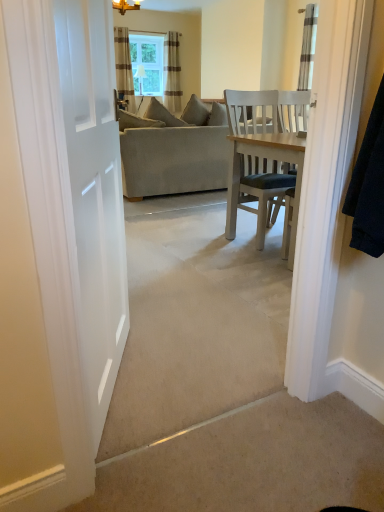
Question: Should I look upward or downward to see striped fabric curtain at upper right, arranged as the third curtain when viewed from the back?

Choices:
 (A) up
 (B) down

Answer: (A)

Question: From the image's perspective, is clear glass window at upper center on striped fabric curtain at upper right, positioned as the third curtain in left-to-right order?

Choices:
 (A) no
 (B) yes

Answer: (B)

Question: Is clear glass window at upper center bigger than striped fabric curtain at upper right, which is counted as the first curtain, starting from the front?

Choices:
 (A) no
 (B) yes

Answer: (B)

Question: Is clear glass window at upper center taller than striped fabric curtain at upper right, which is counted as the first curtain, starting from the front?

Choices:
 (A) no
 (B) yes

Answer: (A)

Question: Can you confirm if clear glass window at upper center is positioned to the left of striped fabric curtain at upper right, which is counted as the first curtain, starting from the front?

Choices:
 (A) no
 (B) yes

Answer: (B)

Question: Is clear glass window at upper center not close to striped fabric curtain at upper right, arranged as the third curtain when viewed from the back?

Choices:
 (A) yes
 (B) no

Answer: (A)

Question: Is clear glass window at upper center thinner than striped fabric curtain at upper right, arranged as the third curtain when viewed from the back?

Choices:
 (A) no
 (B) yes

Answer: (B)

Question: Would you consider striped fabric curtain at upper center, acting as the first curtain starting from the back, to be distant from striped fabric curtain at upper center, positioned as the 1th curtain in left-to-right order?

Choices:
 (A) yes
 (B) no

Answer: (B)

Question: Does striped fabric curtain at upper center, which is the 3th curtain in front-to-back order, come behind striped fabric curtain at upper center, positioned as the 1th curtain in left-to-right order?

Choices:
 (A) no
 (B) yes

Answer: (B)

Question: Can you confirm if striped fabric curtain at upper center, acting as the first curtain starting from the back, is wider than striped fabric curtain at upper center, which is the 2th curtain in front-to-back order?

Choices:
 (A) yes
 (B) no

Answer: (B)

Question: Does striped fabric curtain at upper center, which appears as the second curtain when viewed from the left, come in front of striped fabric curtain at upper center, which is counted as the 2th curtain, starting from the back?

Choices:
 (A) no
 (B) yes

Answer: (A)

Question: Is striped fabric curtain at upper center, which is the 3th curtain in front-to-back order, outside striped fabric curtain at upper center, which is the 3th curtain in right-to-left order?

Choices:
 (A) yes
 (B) no

Answer: (A)

Question: Considering the relative sizes of striped fabric curtain at upper center, which is counted as the 2th curtain, starting from the right, and striped fabric curtain at upper center, positioned as the 1th curtain in left-to-right order, in the image provided, is striped fabric curtain at upper center, which is counted as the 2th curtain, starting from the right, shorter than striped fabric curtain at upper center, positioned as the 1th curtain in left-to-right order,?

Choices:
 (A) no
 (B) yes

Answer: (B)

Question: Is beige fabric couch at center behind striped fabric curtain at upper center, which is counted as the 2th curtain, starting from the right?

Choices:
 (A) yes
 (B) no

Answer: (B)